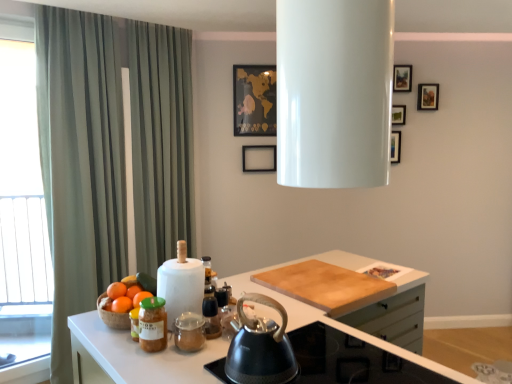
You are a GUI agent. You are given a task and a screenshot of the screen. Output one action in this format:
    pyautogui.click(x=<x>, y=<y>)
    Task: Click on the vacant area situated to the left side of matte glass jar at lower left
    The width and height of the screenshot is (512, 384).
    Given the screenshot: What is the action you would take?
    pyautogui.click(x=112, y=346)